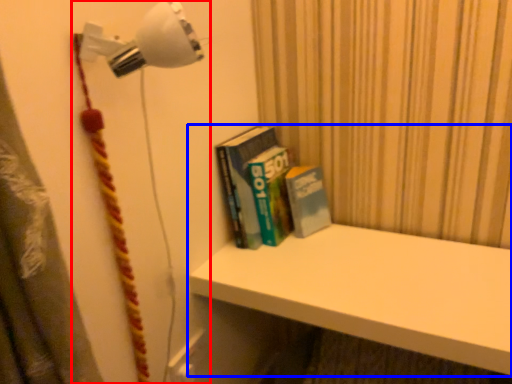
Question: Among these objects, which one is farthest to the camera, lamp (highlighted by a red box) or shelf (highlighted by a blue box)?

Choices:
 (A) lamp
 (B) shelf

Answer: (B)